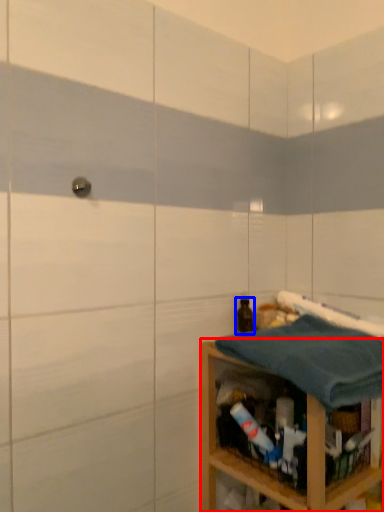
Question: Which object is further to the camera taking this photo, shelf (highlighted by a red box) or bottle (highlighted by a blue box)?

Choices:
 (A) shelf
 (B) bottle

Answer: (B)